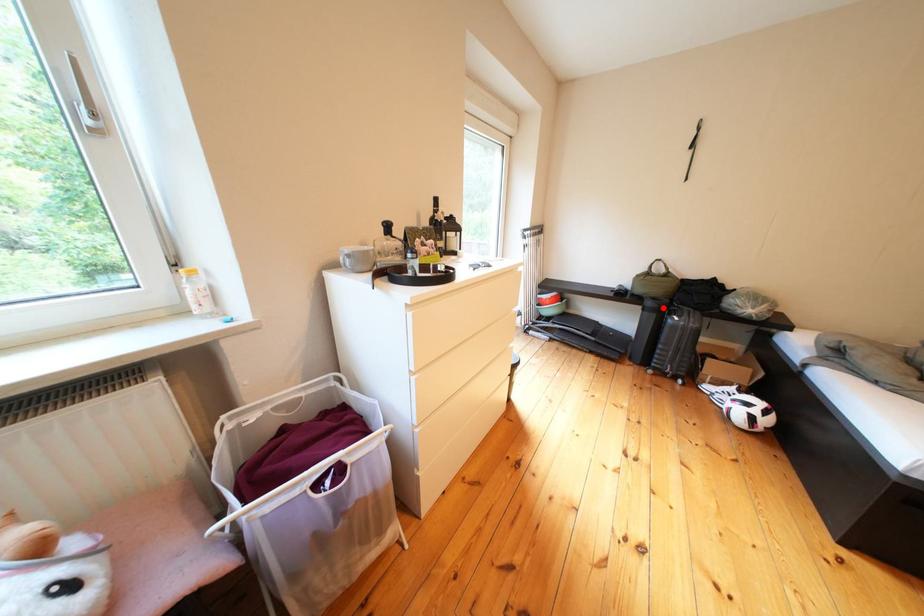
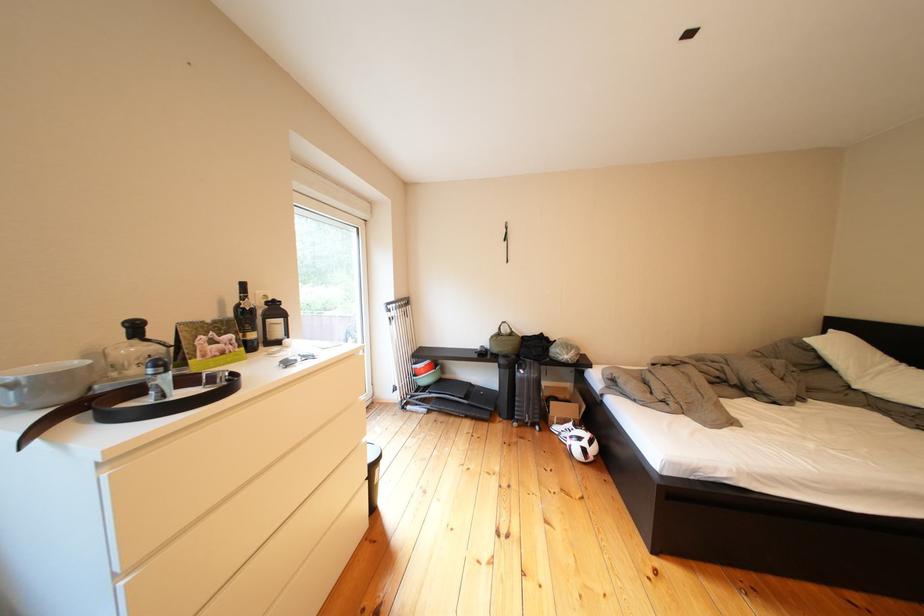
Question: I am providing you with two images of the same scene from different viewpoints. Given a red point in image1, look at the same physical point in image2. Is it:

Choices:
 (A) Closer to the viewpoint
 (B) Farther from the viewpoint

Answer: (B)